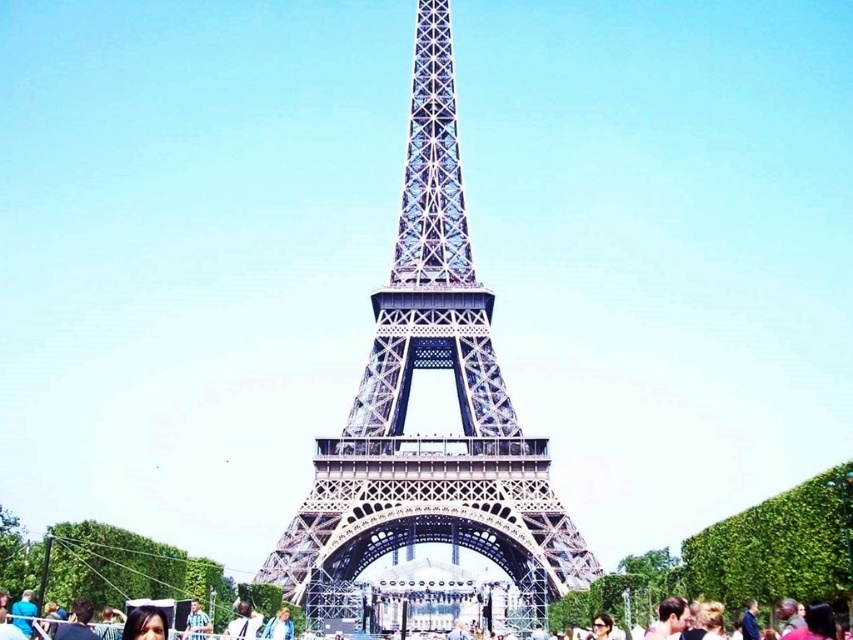
You are standing in front of the Eiffel Tower and see two points marked in the image. The first point is at coordinates point (437, 452) and the second point is at point (4, 625). Which of these two points is closer to you?

Point (4, 625) is closer to you because the description states that point (437, 452) is further to the camera than point (4, 625).

You are a photographer planning to capture a photo of the metallic blue tower at center and the matte black crowd at lower center. Based on their relative sizes in the image, which object appears larger?

The metallic blue tower at center appears larger than the matte black crowd at lower center because it is taller.

You are standing at the point marked as point [408,396] in the image. Looking around, you see the metallic blue tower at center. Which direction should you face to look directly at the metallic blue tower at center?

Since the metallic blue tower at center is located at point [408,396], you are already facing the tower. Therefore, you should face forward to look directly at the metallic blue tower at center.